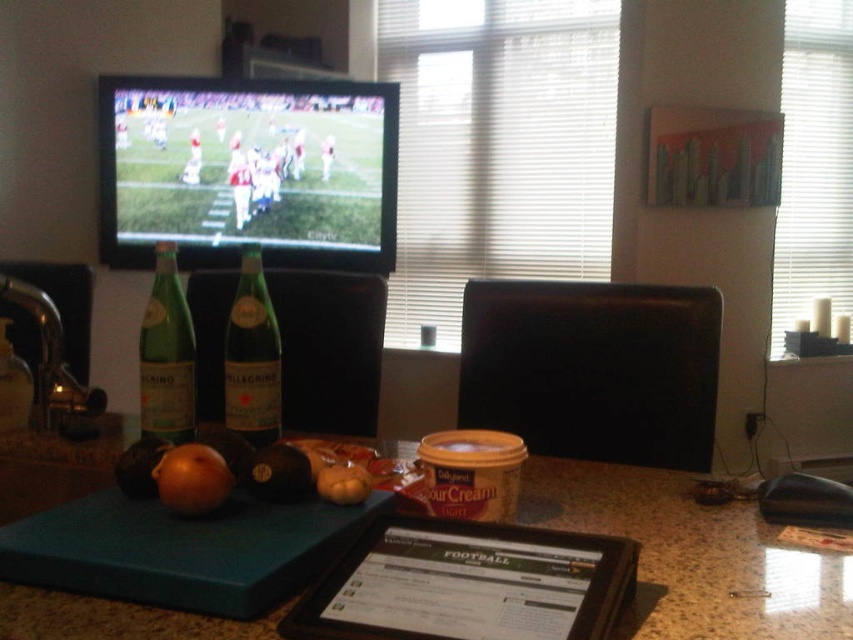
You are organizing items on the granite countertop at center and the green glass bottle at left. According to the scene, which object is located to the left of the other?

The green glass bottle at left is positioned to the left of the granite countertop at center.

You are organizing items on the granite countertop at center and the black matte onion at center. Which object takes up more space on the countertop?

The granite countertop at center is larger in size than the black matte onion at center, so it takes up more space on the countertop.